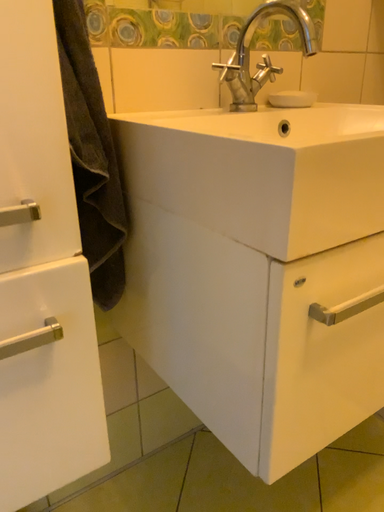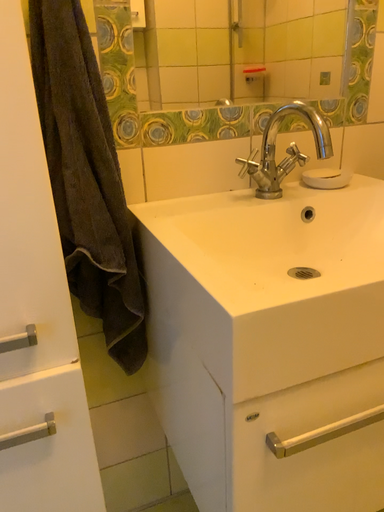
Question: How did the camera likely rotate when shooting the video?

Choices:
 (A) rotated left
 (B) rotated right

Answer: (A)